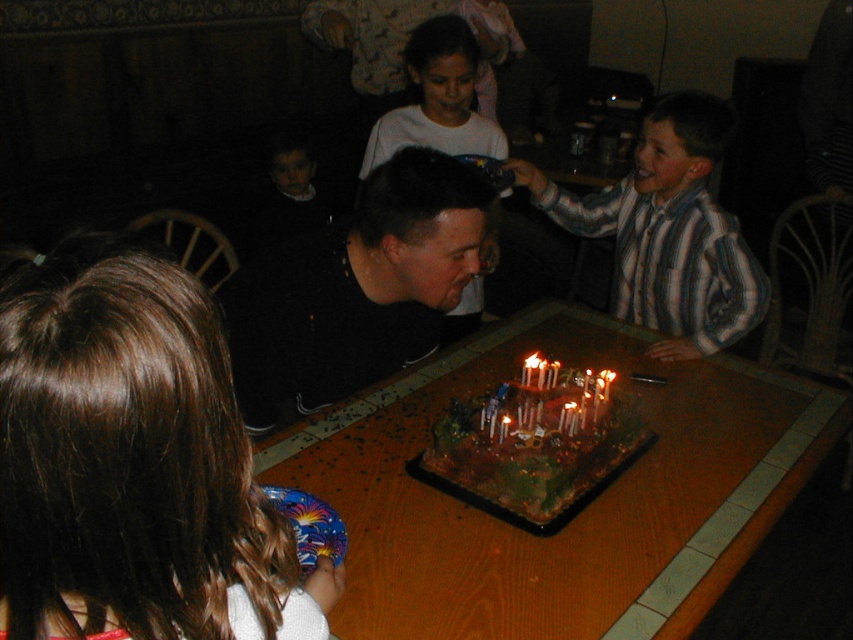
Which is above, white matte shirt at center or white wax candle at center?

white matte shirt at center is above.

Does point (444, 326) lie behind point (509, 417)?

Yes, it is.

Is point (418, 38) positioned in front of point (509, 419)?

No, it is behind (509, 419).

Locate an element on the screen. The image size is (853, 640). white matte shirt at center is located at coordinates (437, 99).

Which is in front, point (646, 472) or point (358, 324)?

Point (646, 472) is more forward.

Which is more to the left, wooden table at center or black matte shirt at center?

Positioned to the left is black matte shirt at center.

Does point (664, 368) come farther from viewer compared to point (352, 358)?

Yes, it is behind point (352, 358).

The image size is (853, 640). I want to click on wooden table at center, so click(579, 513).

Based on the photo, does brown hair at lower left come behind white wax candle at center?

That is False.

This screenshot has width=853, height=640. I want to click on brown hair at lower left, so tap(132, 465).

Measure the distance between brown hair at lower left and camera.

brown hair at lower left is 46.13 centimeters from camera.

Where is `brown hair at lower left`? This screenshot has width=853, height=640. brown hair at lower left is located at coordinates (132, 465).